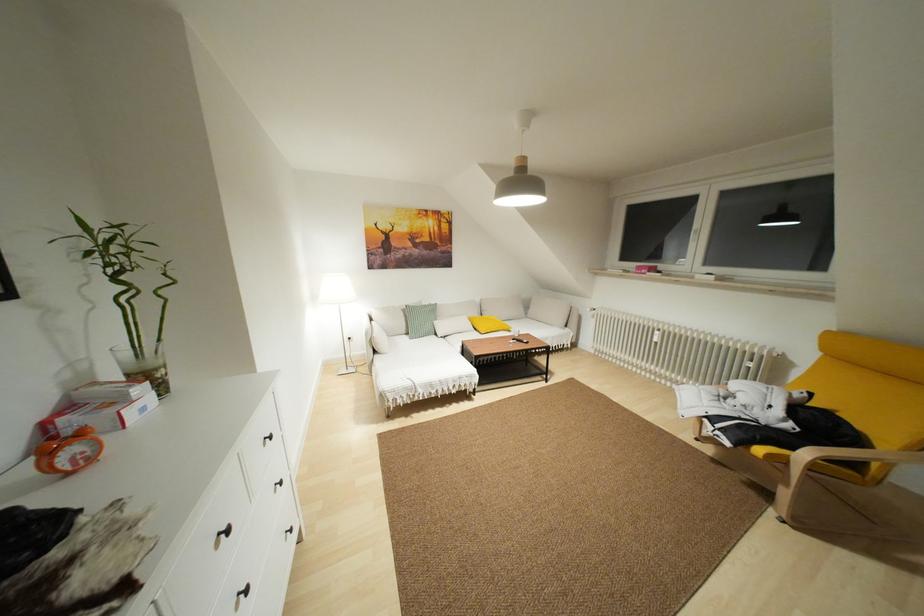
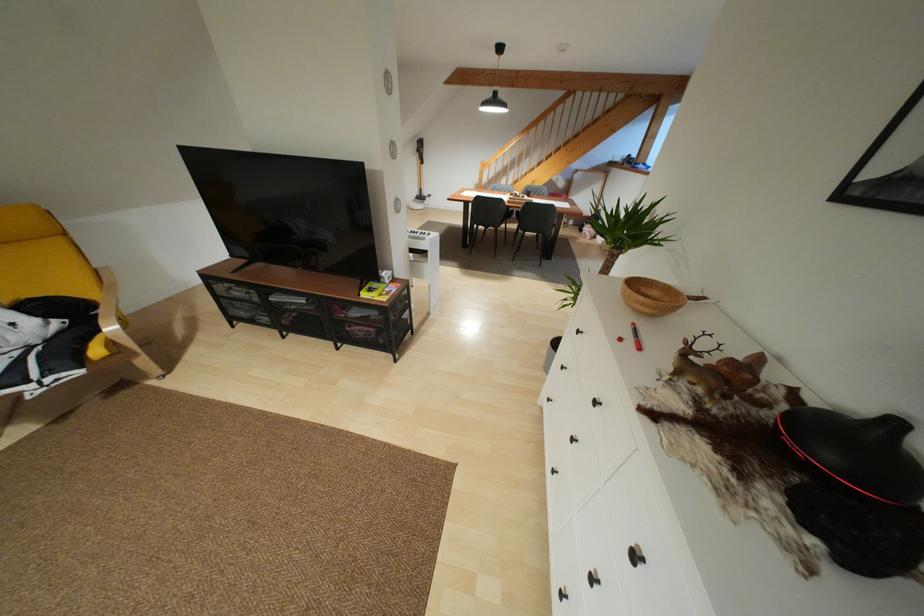
Question: I am providing you with two images of the same scene from different viewpoints. After the viewpoint changes to image2, which objects are now occluded?

Choices:
 (A) wooden bowl
 (B) wooden chair armrest
 (C) small yellow box
 (D) none of these

Answer: (D)